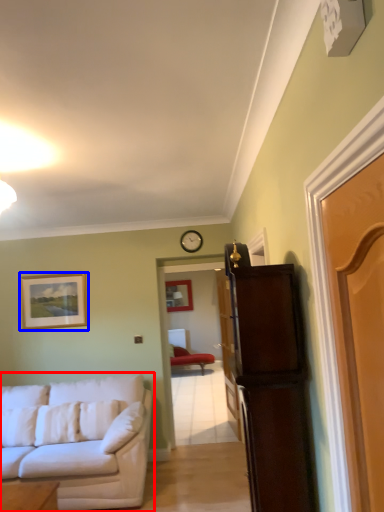
Question: Which point is further to the camera, studio couch (highlighted by a red box) or picture frame (highlighted by a blue box)?

Choices:
 (A) studio couch
 (B) picture frame

Answer: (B)